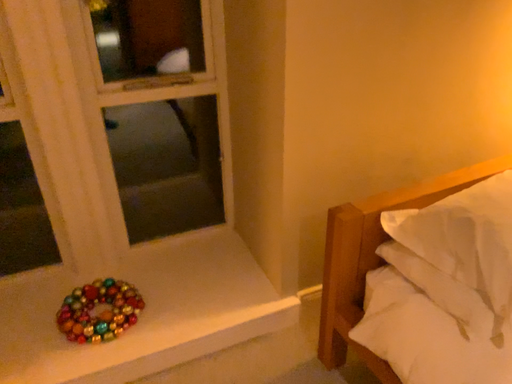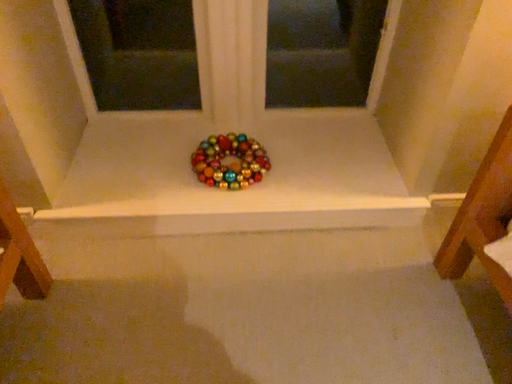
Question: How did the camera likely rotate when shooting the video?

Choices:
 (A) rotated right
 (B) rotated left

Answer: (B)